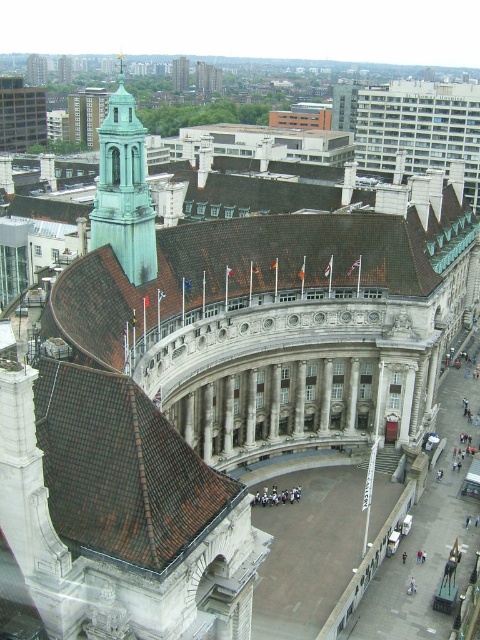
You are a drone operator tasked with capturing a detailed photo of the green copper bell tower at upper left and the green copper spire at upper left. From the perspective of someone looking at the building from the front, which one is positioned to the right?

The green copper bell tower at upper left is positioned to the right of the green copper spire at upper left.

You are a drone operator trying to capture a photo of the city hall from above. Your drone is currently at the center of the building. To include the green copper bell tower at upper left in your shot, in which direction should you move the drone?

You should move the drone to the upper left to include the green copper bell tower at upper left, as it is located at point (x=123, y=192) which is the upper left position relative to the center.

You are a drone operator tasked with capturing aerial footage of the city hall. Your drone has a maximum flight range of 70 meters from its starting position. If you position the drone at the green copper bell tower at upper left, will it be able to fly to the green copper spire at upper left without exceeding its range?

The distance between the green copper bell tower at upper left and the green copper spire at upper left is 74.25 meters, which exceeds the drone operator drone operator drone operator drone operator drone operator drone operator drone operator drone operator drone operator drone operator drone operator drone operator drone operator drone operator drone operator drone operator drone operator drone operator drone operator drone operator drone operator drone operator drone operator drone operator drone ope